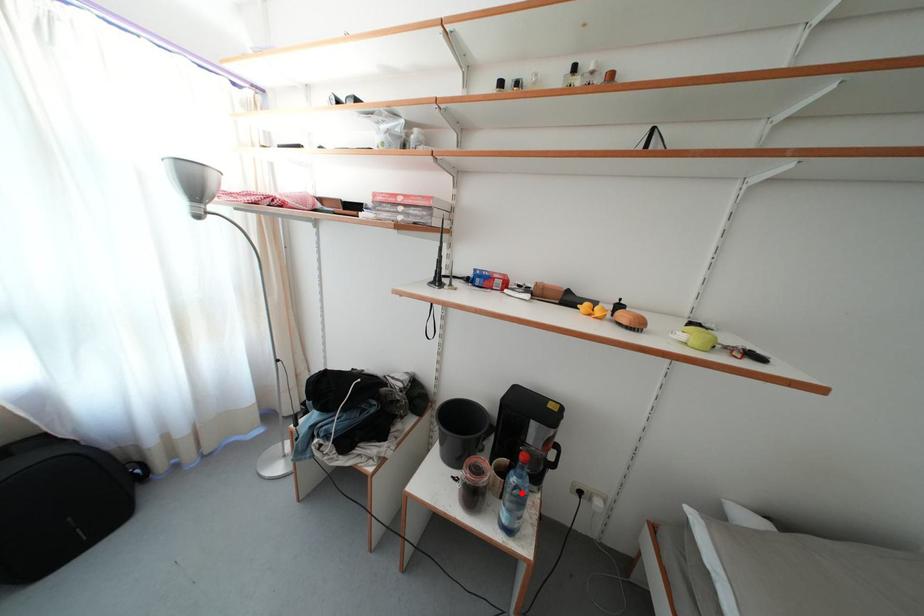
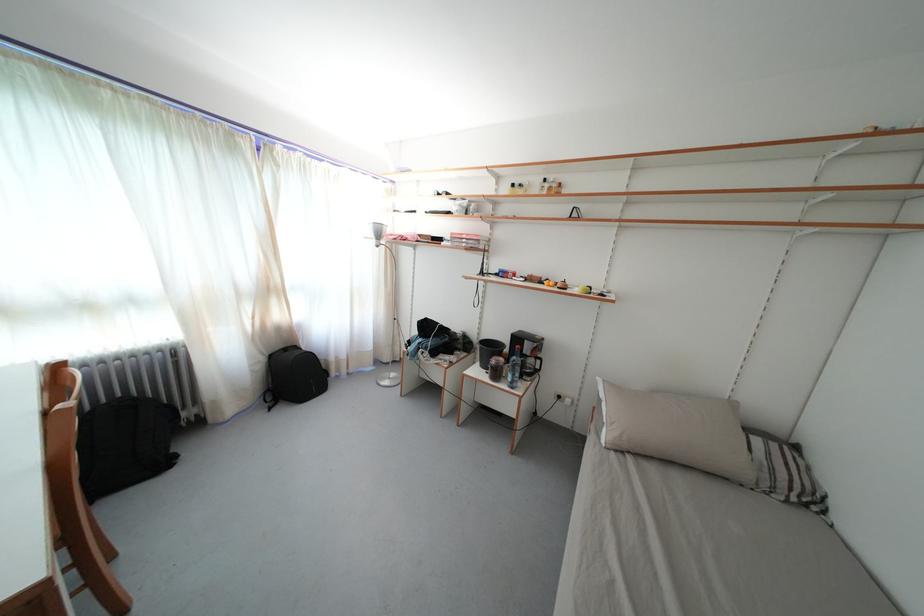
The point at the highlighted location is marked in the first image. Where is the corresponding point in the second image?

(520, 367)